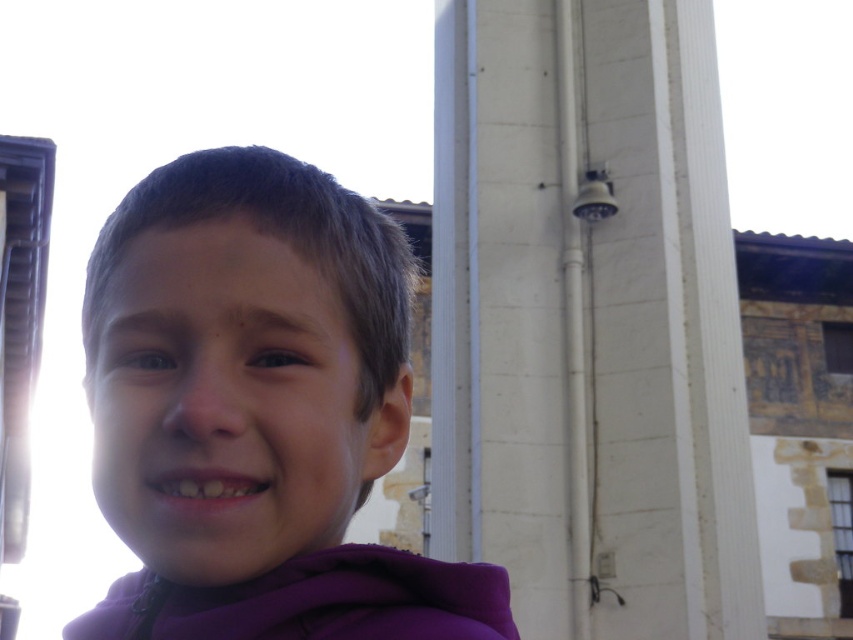
You are a photographer trying to capture the purple fleece at center in the image. The camera you are using has a focus point at coordinate point (257,412). Will this focus point align with the purple fleece at center?

Yes, the point (257,412) marks the purple fleece at center, so the focus point will align with it.

You are standing in front of the building with the white facade and exposed pipes. You notice two points marked in the image. The first point is at coordinates point (849, 598) and the second is at point (831, 339). Which point is nearer to you?

Point (849, 598) is closer to the viewer than point (831, 339).

You are standing at the point with coordinates point (x=827, y=348) and want to walk to the point with coordinates point (x=166, y=580). Which direction should you move in relation to the security camera mounted on the wall near the top right corner of the frame?

You should move towards the direction away from the security camera mounted on the wall near the top right corner of the frame because point (x=166, y=580) is in front of point (x=827, y=348).